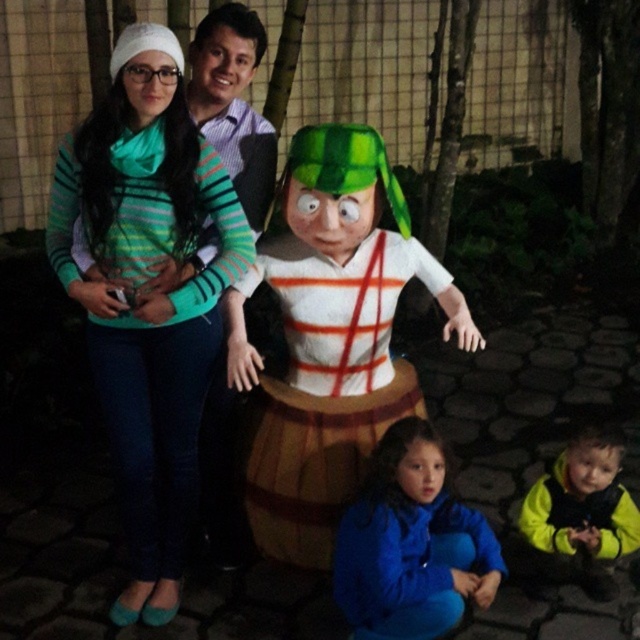
Does wooden barrel at center appear on the left side of yellow fleece jacket at lower right?

Correct, you'll find wooden barrel at center to the left of yellow fleece jacket at lower right.

Can you confirm if wooden barrel at center is thinner than yellow fleece jacket at lower right?

Incorrect, wooden barrel at center's width is not less than yellow fleece jacket at lower right's.

Which is in front, point (280, 458) or point (602, 468)?

Point (602, 468) is in front.

At what (x,y) coordinates should I click in order to perform the action: click on wooden barrel at center. Please return your answer as a coordinate pair (x, y). The width and height of the screenshot is (640, 640). Looking at the image, I should click on (326, 385).

Is wooden barrel at center taller than matte green fabric at center?

Yes, wooden barrel at center is taller than matte green fabric at center.

Between point (291, 481) and point (218, 134), which one is positioned in front?

Point (291, 481) is more forward.

Does point (372, 282) come farther from viewer compared to point (276, 145)?

No, (372, 282) is closer to viewer.

The width and height of the screenshot is (640, 640). What are the coordinates of `wooden barrel at center` in the screenshot? It's located at (326, 385).

Can you confirm if green striped sweater at upper left is thinner than matte green fabric at center?

Incorrect, green striped sweater at upper left's width is not less than matte green fabric at center's.

Between point (116, 128) and point (198, 72), which one is positioned in front?

Point (116, 128) is more forward.

You are a GUI agent. You are given a task and a screenshot of the screen. Output one action in this format:
    pyautogui.click(x=<x>, y=<y>)
    Task: Click on the green striped sweater at upper left
    
    Given the screenshot: What is the action you would take?
    pos(147,296)